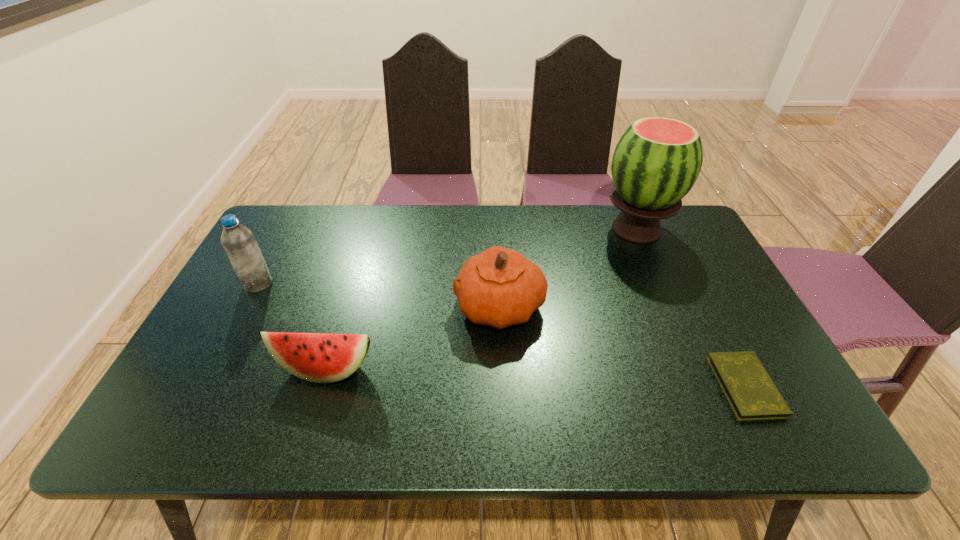
Find the location of a particular element. This screenshot has height=540, width=960. the tallest object is located at coordinates tap(656, 162).

Where is `the farthest object`? the farthest object is located at coordinates (656, 162).

At what (x,y) coordinates should I click in order to perform the action: click on the second tallest object. Please return your answer as a coordinate pair (x, y). Looking at the image, I should click on (238, 241).

Where is `water bottle`? The width and height of the screenshot is (960, 540). water bottle is located at coordinates (238, 241).

Locate an element on the screen. This screenshot has width=960, height=540. the third tallest object is located at coordinates (499, 287).

At what (x,y) coordinates should I click in order to perform the action: click on pumpkin. Please return your answer as a coordinate pair (x, y). This screenshot has height=540, width=960. Looking at the image, I should click on (499, 287).

Where is `the second shortest object`? The image size is (960, 540). the second shortest object is located at coordinates (316, 357).

The image size is (960, 540). In order to click on the left watermelon in this screenshot , I will do `click(316, 357)`.

The height and width of the screenshot is (540, 960). What are the coordinates of `diary` in the screenshot? It's located at (750, 391).

The height and width of the screenshot is (540, 960). Identify the location of free location located on the left of the farther watermelon. pos(499,229).